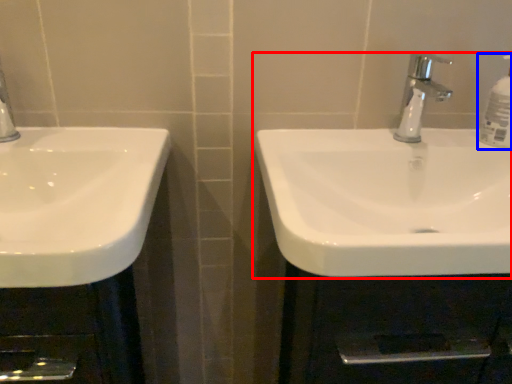
Question: Which of the following is the closest to the observer, sink (highlighted by a red box) or soap dispenser (highlighted by a blue box)?

Choices:
 (A) sink
 (B) soap dispenser

Answer: (A)